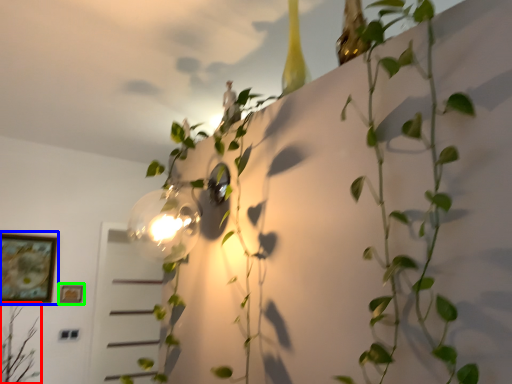
Question: Which is farther away from plant (highlighted by a red box)? picture frame (highlighted by a blue box) or picture frame (highlighted by a green box)?

Choices:
 (A) picture frame
 (B) picture frame

Answer: (B)